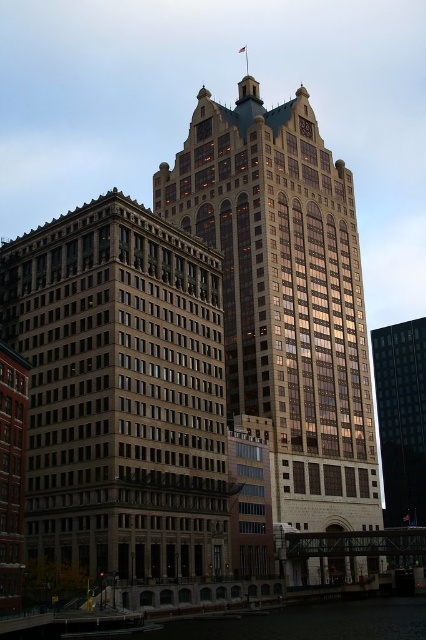
How distant is gold glass skyscraper at center from black glass building at right?

53.09 meters

Which is more to the right, gold glass skyscraper at center or black glass building at right?

From the viewer's perspective, black glass building at right appears more on the right side.

Does point (273, 179) come farther from viewer compared to point (412, 332)?

No, it is in front of (412, 332).

Identify the location of gold glass skyscraper at center. (285, 296).

Is brown stone building at center wider than black glass building at right?

Yes, brown stone building at center is wider than black glass building at right.

Between brown stone building at center and black glass building at right, which one is positioned lower?

black glass building at right is lower down.

Between point (140, 346) and point (412, 518), which one is positioned behind?

The point (412, 518) is behind.

Where is `brown stone building at center`? The image size is (426, 640). brown stone building at center is located at coordinates (120, 392).

Which of these two, gold glass skyscraper at center or clear water at lower center, stands taller?

gold glass skyscraper at center

What do you see at coordinates (285, 296) in the screenshot? The height and width of the screenshot is (640, 426). I see `gold glass skyscraper at center` at bounding box center [285, 296].

Does point (376, 524) come closer to viewer compared to point (51, 625)?

No, (376, 524) is behind (51, 625).

Locate an element on the screen. gold glass skyscraper at center is located at coordinates (285, 296).